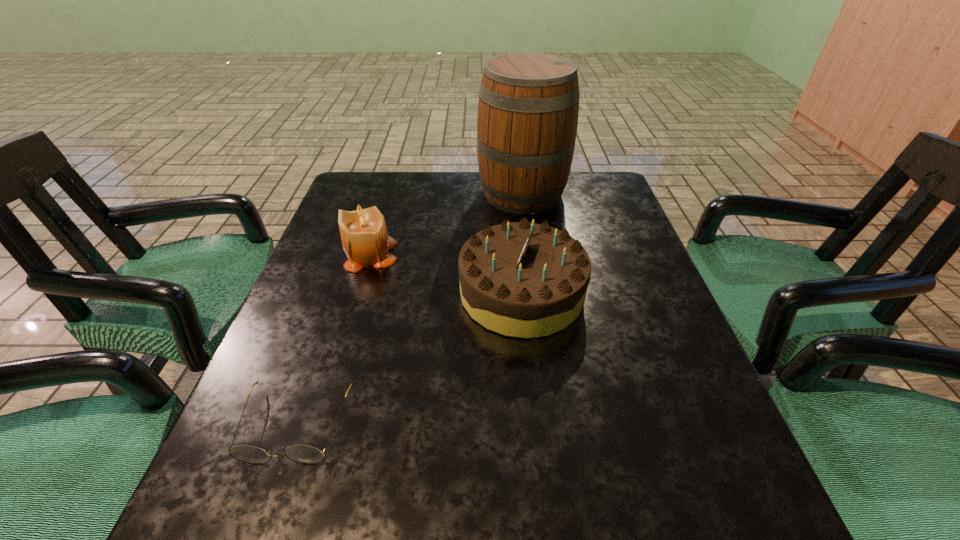
I want to click on free space located on the front-facing side of the birthday cake, so click(x=326, y=293).

Find the location of a particular element. vacant space located 0.060m on the temples of the shortest object is located at coordinates (267, 511).

Locate an element on the screen. object at the far edge is located at coordinates (528, 106).

Identify the location of candle present at the left edge. (365, 240).

The image size is (960, 540). Identify the location of spectacles located at the left edge. (303, 453).

The height and width of the screenshot is (540, 960). I want to click on object at the right edge, so click(x=528, y=106).

This screenshot has width=960, height=540. Find the location of `object present at the far right corner`. object present at the far right corner is located at coordinates (528, 106).

At what (x,y) coordinates should I click in order to perform the action: click on vacant region at the far edge of the desktop. Please return your answer as a coordinate pair (x, y). Image resolution: width=960 pixels, height=540 pixels. Looking at the image, I should click on (465, 176).

Where is `free space at the near edge of the desktop`? This screenshot has height=540, width=960. free space at the near edge of the desktop is located at coordinates (623, 496).

Find the location of a particular element. The width and height of the screenshot is (960, 540). blank space at the left edge is located at coordinates (321, 240).